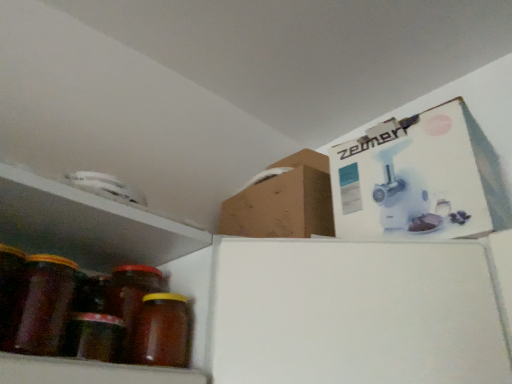
Question: Is brown matte jar at left, marked as the 1th bottle in a left-to-right arrangement, not inside translucent amber glass jar at lower left?

Choices:
 (A) no
 (B) yes

Answer: (B)

Question: Does brown matte jar at left, marked as the 1th bottle in a left-to-right arrangement, have a lesser width compared to translucent amber glass jar at lower left?

Choices:
 (A) no
 (B) yes

Answer: (A)

Question: Is brown matte jar at left, marked as the 1th bottle in a left-to-right arrangement, smaller than translucent amber glass jar at lower left?

Choices:
 (A) no
 (B) yes

Answer: (A)

Question: From a real-world perspective, is brown matte jar at left, which is counted as the second bottle, starting from the right, physically below translucent amber glass jar at lower left?

Choices:
 (A) no
 (B) yes

Answer: (A)

Question: From the image's perspective, is brown matte jar at left, which is counted as the second bottle, starting from the right, located above translucent amber glass jar at lower left?

Choices:
 (A) no
 (B) yes

Answer: (A)

Question: Visually, is brown matte jar at lower left, the first bottle from the right, positioned to the left or to the right of brown matte jar at left, marked as the 1th bottle in a left-to-right arrangement?

Choices:
 (A) right
 (B) left

Answer: (A)

Question: Is point (176, 329) positioned closer to the camera than point (32, 307)?

Choices:
 (A) closer
 (B) farther

Answer: (B)

Question: From the image's perspective, is brown matte jar at lower left, the 2th bottle in the left-to-right sequence, located above or below brown matte jar at left, marked as the 1th bottle in a left-to-right arrangement?

Choices:
 (A) below
 (B) above

Answer: (A)

Question: In terms of height, does brown matte jar at lower left, the 2th bottle in the left-to-right sequence, look taller or shorter compared to brown matte jar at left, marked as the 1th bottle in a left-to-right arrangement?

Choices:
 (A) short
 (B) tall

Answer: (A)

Question: Do you think translucent amber glass jar at lower left is within brown matte jar at lower left, the 2th bottle in the left-to-right sequence, or outside of it?

Choices:
 (A) outside
 (B) inside

Answer: (A)

Question: Visually, is translucent amber glass jar at lower left positioned to the left or to the right of brown matte jar at lower left, the 2th bottle in the left-to-right sequence?

Choices:
 (A) left
 (B) right

Answer: (A)

Question: Is translucent amber glass jar at lower left wider or thinner than brown matte jar at lower left, the first bottle from the right?

Choices:
 (A) wide
 (B) thin

Answer: (B)

Question: In the image, is translucent amber glass jar at lower left positioned in front of or behind brown matte jar at lower left, the 2th bottle in the left-to-right sequence?

Choices:
 (A) front
 (B) behind

Answer: (A)

Question: Is brown matte jar at left, marked as the 1th bottle in a left-to-right arrangement, spatially inside translucent amber glass jar at lower left, or outside of it?

Choices:
 (A) inside
 (B) outside

Answer: (B)

Question: Considering the positions of point (20, 337) and point (13, 276), is point (20, 337) closer or farther from the camera than point (13, 276)?

Choices:
 (A) farther
 (B) closer

Answer: (B)